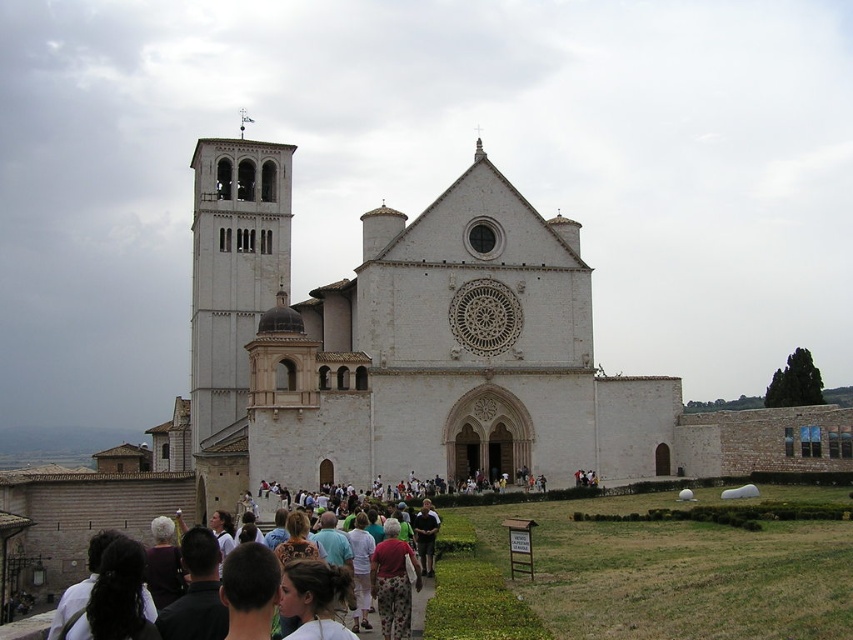
Looking at this image, you are standing at the entrance of the church and want to take a photo of the bell tower. There are two points marked on the ground where you can stand to get the best shot. The first point is at coordinate point(381, 323), and the second is at point(283, 188). Which point should you choose to ensure the bell tower is fully visible in your photo?

You should choose point(381, 323) because it is in front of point(283, 188), providing a better vantage point to capture the entire bell tower in your photo.